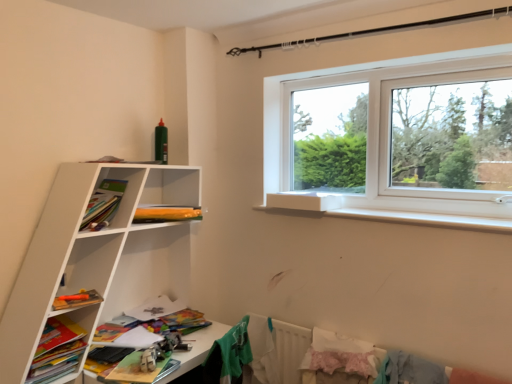
Question: Do you think light blue fabric at lower right, which ranks as the first clothing in right-to-left order, is within black metal clothesline at upper center, or outside of it?

Choices:
 (A) outside
 (B) inside

Answer: (A)

Question: From the image's perspective, is light blue fabric at lower right, marked as the third clothing in a left-to-right arrangement, located above or below black metal clothesline at upper center?

Choices:
 (A) above
 (B) below

Answer: (B)

Question: Which is farther from the matte orange pencil case at upper left, which is the 2th book in front-to-back order?

Choices:
 (A) fluffy pink fabric at lower right, the 2th clothing positioned from the left
 (B) wooden toy car at lower left
 (C) white matte bookshelf at lower left, the first shelf from the bottom
 (D) white matte shelf at left, the 1th shelf viewed from the top
 (E) light blue fabric at lower right, which ranks as the first clothing in right-to-left order

Answer: (E)

Question: Which of these objects is positioned closest to the fluffy pink fabric at lower right, the 2th clothing positioned from the left?

Choices:
 (A) white matte bookshelf at lower left, the first shelf from the bottom
 (B) black metal clothesline at upper center
 (C) light blue fabric at lower right, marked as the third clothing in a left-to-right arrangement
 (D) green fabric shirt at lower center, which ranks as the third clothing in right-to-left order
 (E) matte orange pencil case at upper left, which is the 2th book in front-to-back order

Answer: (C)